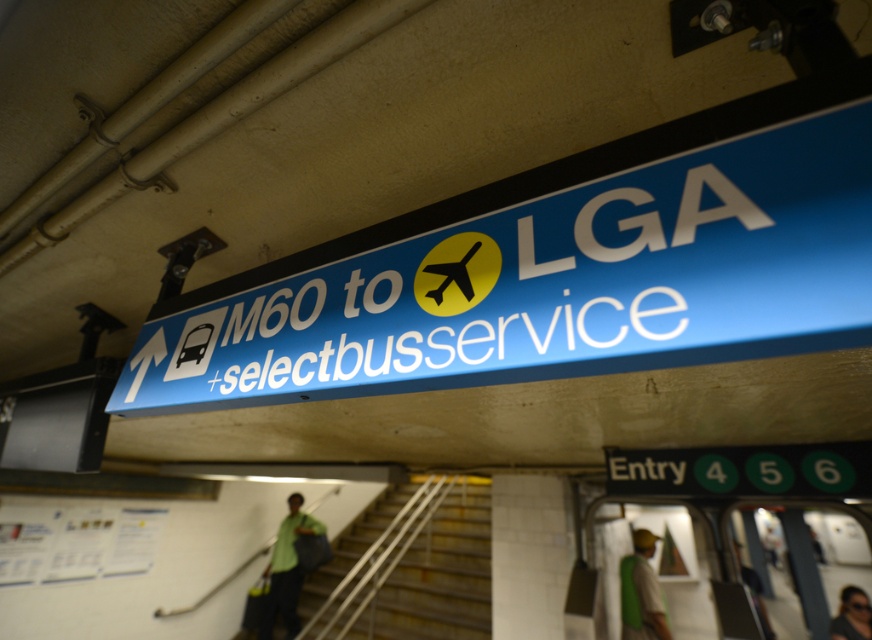
You are standing at the station and see two points marked on the floor. The first point is at coordinate point(296, 513) and the second is at point(623, 604). Which point is closer to you?

Point(296, 513) is behind point(623, 604), so the closer point to you is point(623, 604).

You are a traveler carrying a heavy suitcase and need to reach the M60 bus stop as quickly as possible. You see the metallic gray stairs at center and dark hair at upper right. Which direction should you head towards?

You should head towards the metallic gray stairs at center because they are closer to you than the dark hair at upper right, which is 4.17 meters away.

You are a traveler at the station and need to pack your green fabric bag at lower right and green fabric shirt at lower right into a narrow storage compartment. Which item should you place first to ensure both fit?

The green fabric bag at lower right is thinner than the green fabric shirt at lower right, so you should place the green fabric shirt at lower right first to make space for the thinner bag.